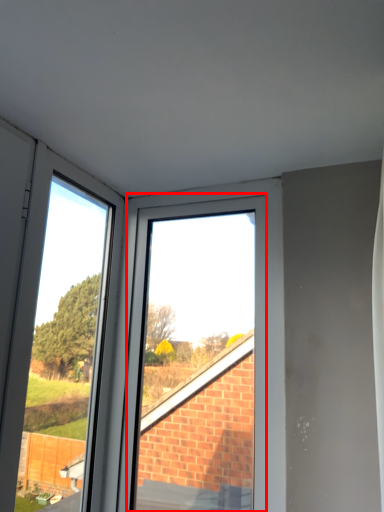
Question: In this image, where is bay window (annotated by the red box) located relative to glass door?

Choices:
 (A) left
 (B) right

Answer: (B)